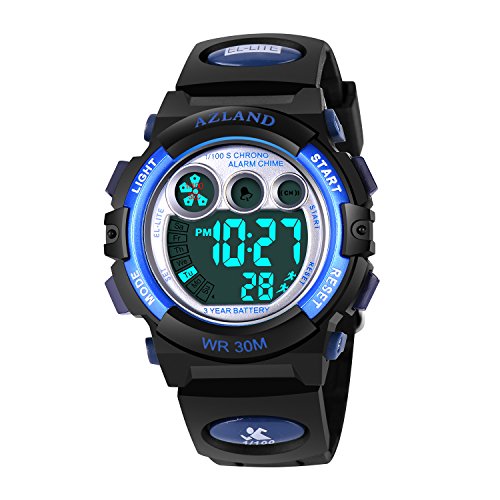
Where is `clock face`? clock face is located at coordinates (203, 253).